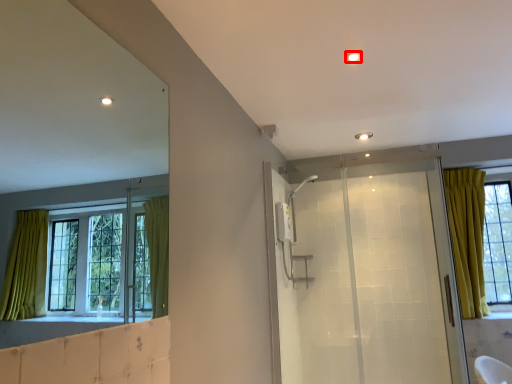
Question: Where is light (annotated by the red box) located in relation to screen door in the image?

Choices:
 (A) right
 (B) left

Answer: (B)